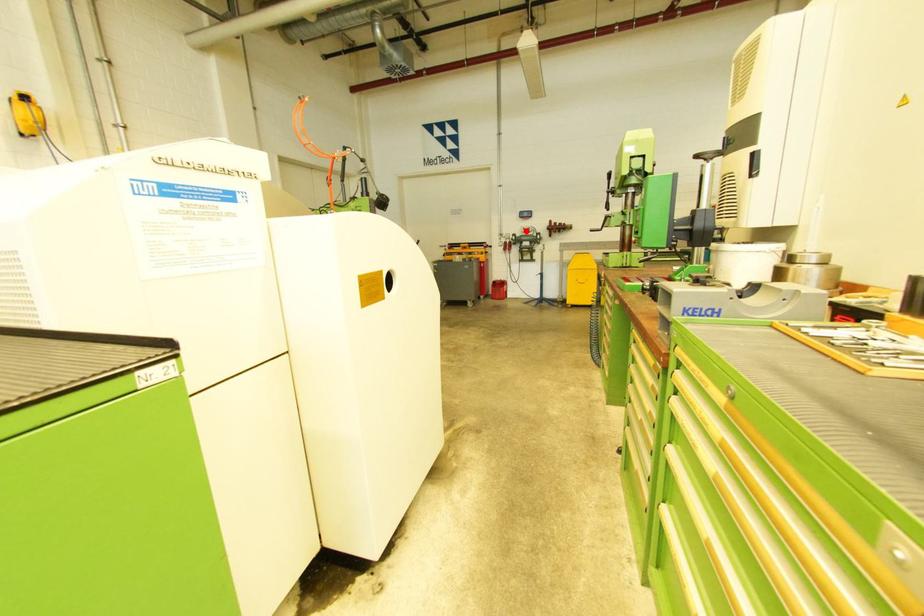
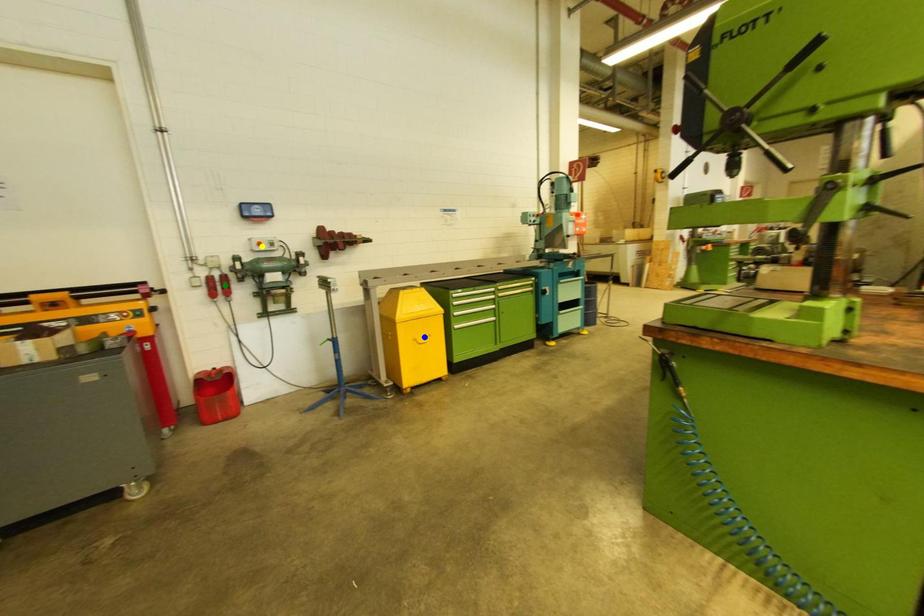
Question: I am providing you with two images of the same scene from different viewpoints. A red point is marked on the first image. You are given multiple points on the second image. In image 2, which mark is for the same physical point as the one in image 1?

Choices:
 (A) blue point
 (B) yellow point
 (C) green point

Answer: (B)